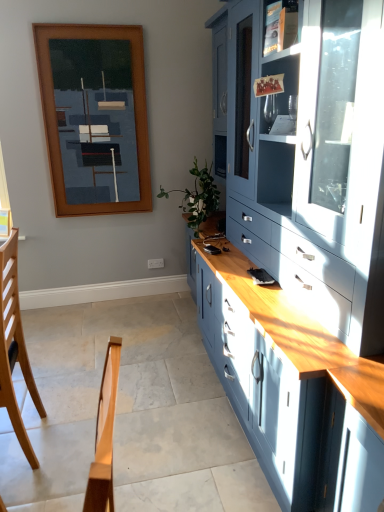
Question: From a real-world perspective, is matte blue cabinet at right below light brown wood chair at lower left?

Choices:
 (A) no
 (B) yes

Answer: (A)

Question: Does matte blue cabinet at right appear on the right side of light brown wood chair at lower left?

Choices:
 (A) no
 (B) yes

Answer: (B)

Question: Is matte blue cabinet at right surrounding light brown wood chair at lower left?

Choices:
 (A) yes
 (B) no

Answer: (B)

Question: Can you confirm if matte blue cabinet at right is shorter than light brown wood chair at lower left?

Choices:
 (A) no
 (B) yes

Answer: (A)

Question: Can you confirm if matte blue cabinet at right is taller than light brown wood chair at lower left?

Choices:
 (A) no
 (B) yes

Answer: (B)

Question: Considering the positions of point (213, 194) and point (286, 12), is point (213, 194) closer or farther from the camera than point (286, 12)?

Choices:
 (A) farther
 (B) closer

Answer: (A)

Question: From the image's perspective, relative to matte glass shelf at upper right, is green leafy plant at center above or below?

Choices:
 (A) below
 (B) above

Answer: (A)

Question: From a real-world perspective, is green leafy plant at center positioned above or below matte glass shelf at upper right?

Choices:
 (A) above
 (B) below

Answer: (B)

Question: Is green leafy plant at center in front of or behind matte glass shelf at upper right in the image?

Choices:
 (A) front
 (B) behind

Answer: (B)

Question: Is matte blue cabinet at right in front of or behind matte glass shelf at upper right in the image?

Choices:
 (A) behind
 (B) front

Answer: (B)

Question: From the image's perspective, is matte blue cabinet at right positioned above or below matte glass shelf at upper right?

Choices:
 (A) above
 (B) below

Answer: (B)

Question: Is point (271, 56) positioned closer to the camera than point (268, 7)?

Choices:
 (A) closer
 (B) farther

Answer: (B)

Question: Visually, is matte blue cabinet at right positioned to the left or to the right of matte glass shelf at upper right?

Choices:
 (A) right
 (B) left

Answer: (A)

Question: From a real-world perspective, is green leafy plant at center positioned above or below matte blue cabinet at right?

Choices:
 (A) above
 (B) below

Answer: (B)

Question: Considering the positions of green leafy plant at center and matte blue cabinet at right in the image, is green leafy plant at center bigger or smaller than matte blue cabinet at right?

Choices:
 (A) big
 (B) small

Answer: (B)